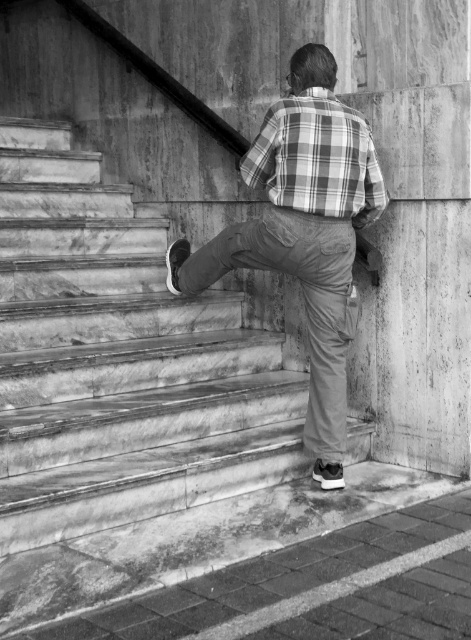
You are an assistant helping someone choose an outfit. They want to wear either the plaid cotton shirt at center or the plaid fabric shirt at center. Which one is bigger in size?

The plaid cotton shirt at center is larger in size than the plaid fabric shirt at center.

You are standing at the base of the marble stairs and want to reach the top. There are two points marked on the wall near the handrail. The first point is at coordinates point (366, 161) and the second point is at point (349, 131). Which point is closer to you as you look up the stairs?

Point (366, 161) is closer to you because it is further to the viewer than point (349, 131), meaning it appears nearer in the image.